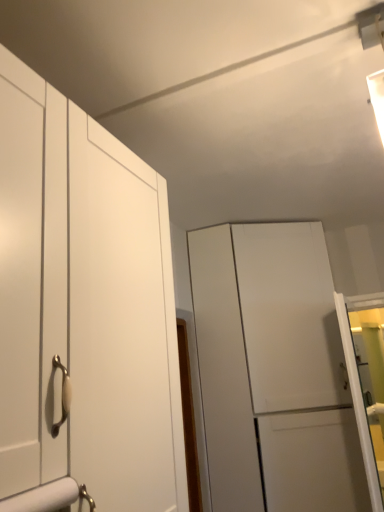
The width and height of the screenshot is (384, 512). I want to click on transparent glass door at right, so click(366, 380).

What do you see at coordinates (366, 380) in the screenshot? I see `transparent glass door at right` at bounding box center [366, 380].

At what (x,y) coordinates should I click in order to perform the action: click on transparent glass door at right. Please return your answer as a coordinate pair (x, y). The width and height of the screenshot is (384, 512). Looking at the image, I should click on (366, 380).